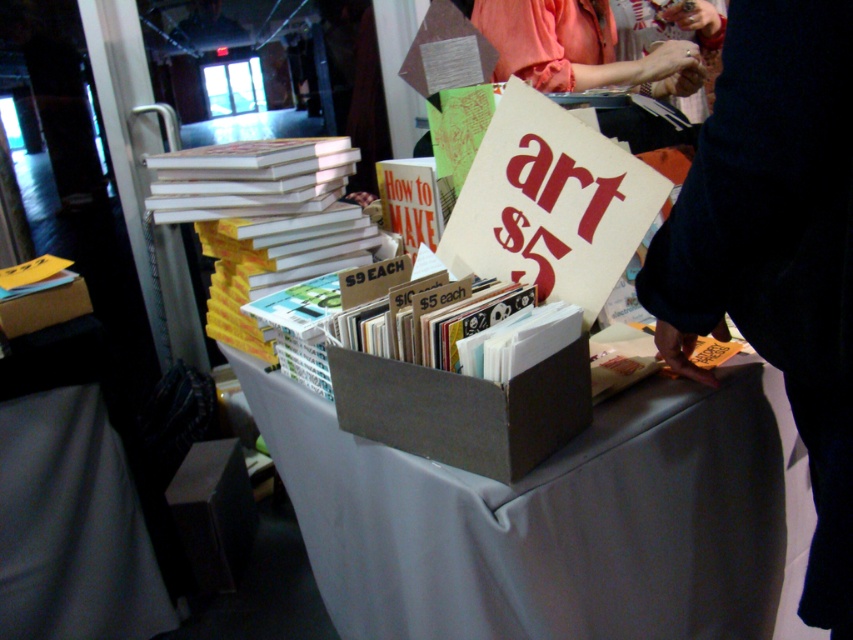
Is point (212, 253) positioned behind point (427, 337)?

Yes, it is.

Between point (216, 268) and point (352, 337), which one is positioned in front?

Point (352, 337) is in front.

You are a GUI agent. You are given a task and a screenshot of the screen. Output one action in this format:
    pyautogui.click(x=<x>, y=<y>)
    Task: Click on the yellow paperbacks at center
    This screenshot has width=853, height=640.
    Given the screenshot: What is the action you would take?
    pyautogui.click(x=263, y=220)

Which is in front, point (514, 550) or point (688, 81)?

Positioned in front is point (514, 550).

Consider the image. Does gray fabric tablecloth at center have a lesser height compared to orange fabric hand at upper center?

Incorrect, gray fabric tablecloth at center's height does not fall short of orange fabric hand at upper center's.

Locate an element on the screen. The height and width of the screenshot is (640, 853). gray fabric tablecloth at center is located at coordinates (558, 520).

Identify the location of gray fabric tablecloth at center. The width and height of the screenshot is (853, 640). (558, 520).

Does dark blue sweater at upper right have a lesser height compared to orange fabric hand at upper center?

In fact, dark blue sweater at upper right may be taller than orange fabric hand at upper center.

Who is shorter, dark blue sweater at upper right or orange fabric hand at upper center?

orange fabric hand at upper center

Is point (834, 324) more distant than point (665, 72)?

No.

At what (x,y) coordinates should I click in order to perform the action: click on dark blue sweater at upper right. Please return your answer as a coordinate pair (x, y). Image resolution: width=853 pixels, height=640 pixels. Looking at the image, I should click on (776, 250).